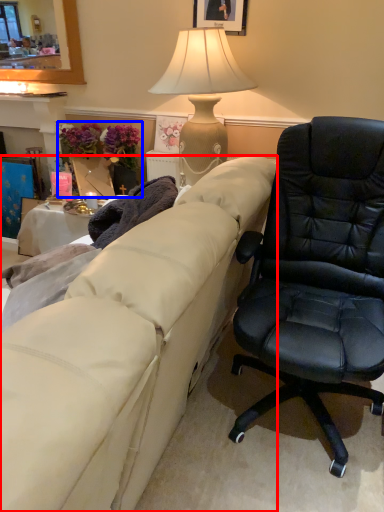
Question: Which of the following is the closest to the observer, studio couch (highlighted by a red box) or houseplant (highlighted by a blue box)?

Choices:
 (A) studio couch
 (B) houseplant

Answer: (A)